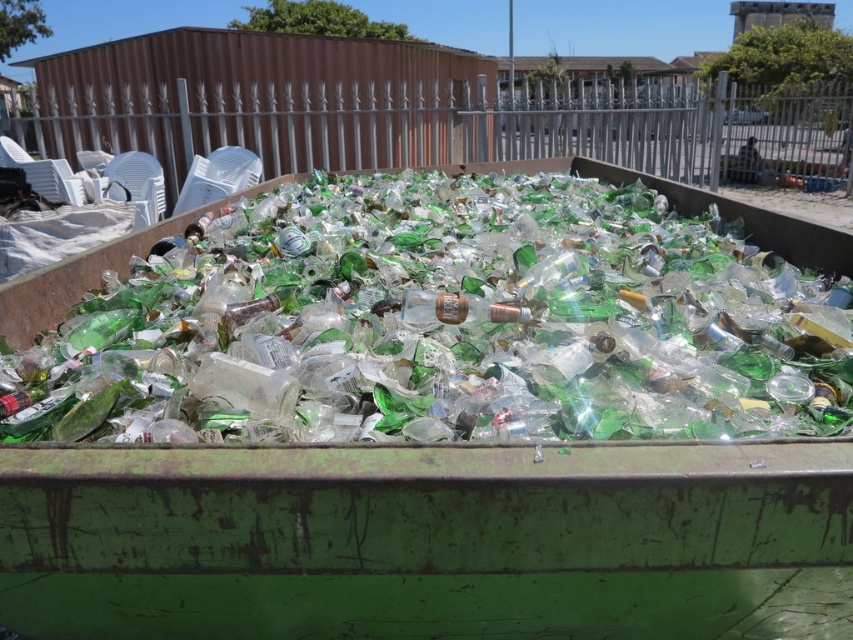
Can you confirm if green glass bottles at center is positioned below clear glass bottle at center?

No.

Looking at this image, does green glass bottles at center come behind clear glass bottle at center?

No, green glass bottles at center is closer to the viewer.

Describe the element at coordinates (440, 324) in the screenshot. I see `green glass bottles at center` at that location.

What are the coordinates of `green glass bottles at center` in the screenshot? It's located at (440, 324).